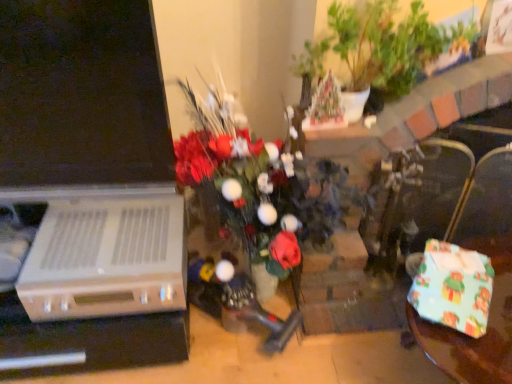
Question: Is wrapping paper gift at lower right smaller than dark brown leather armchair at right?

Choices:
 (A) yes
 (B) no

Answer: (A)

Question: Does wrapping paper gift at lower right have a larger size compared to dark brown leather armchair at right?

Choices:
 (A) yes
 (B) no

Answer: (B)

Question: Can you see wrapping paper gift at lower right touching dark brown leather armchair at right?

Choices:
 (A) no
 (B) yes

Answer: (A)

Question: Are wrapping paper gift at lower right and dark brown leather armchair at right far apart?

Choices:
 (A) yes
 (B) no

Answer: (B)

Question: From the image's perspective, would you say wrapping paper gift at lower right is shown under dark brown leather armchair at right?

Choices:
 (A) yes
 (B) no

Answer: (A)

Question: From a real-world perspective, is dark brown leather armchair at right above or below green leafy plant at upper center?

Choices:
 (A) above
 (B) below

Answer: (B)

Question: In terms of size, does dark brown leather armchair at right appear bigger or smaller than green leafy plant at upper center?

Choices:
 (A) big
 (B) small

Answer: (B)

Question: Looking at their shapes, would you say dark brown leather armchair at right is wider or thinner than green leafy plant at upper center?

Choices:
 (A) thin
 (B) wide

Answer: (A)

Question: From the image's perspective, is dark brown leather armchair at right located above or below green leafy plant at upper center?

Choices:
 (A) above
 (B) below

Answer: (B)

Question: From the image's perspective, is wrapping paper gift at lower right above or below green leafy plant at upper center?

Choices:
 (A) below
 (B) above

Answer: (A)

Question: Is wrapping paper gift at lower right inside the boundaries of green leafy plant at upper center, or outside?

Choices:
 (A) outside
 (B) inside

Answer: (A)

Question: In terms of height, does wrapping paper gift at lower right look taller or shorter compared to green leafy plant at upper center?

Choices:
 (A) short
 (B) tall

Answer: (A)

Question: Considering the positions of wrapping paper gift at lower right and green leafy plant at upper center in the image, is wrapping paper gift at lower right wider or thinner than green leafy plant at upper center?

Choices:
 (A) thin
 (B) wide

Answer: (B)

Question: Looking at their shapes, would you say green leafy plant at upper center is wider or thinner than dark brown leather armchair at right?

Choices:
 (A) thin
 (B) wide

Answer: (B)

Question: Considering the positions of green leafy plant at upper center and dark brown leather armchair at right in the image, is green leafy plant at upper center taller or shorter than dark brown leather armchair at right?

Choices:
 (A) short
 (B) tall

Answer: (A)